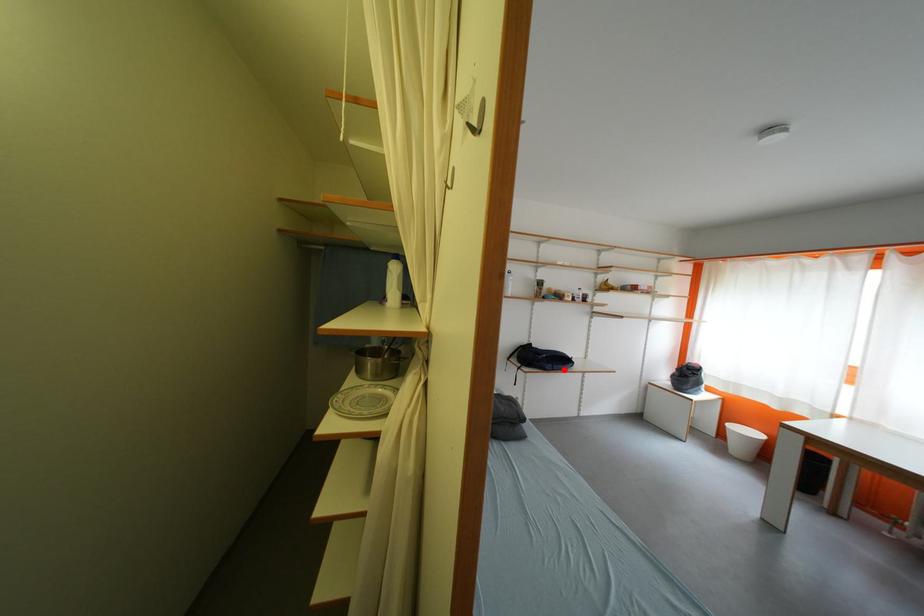
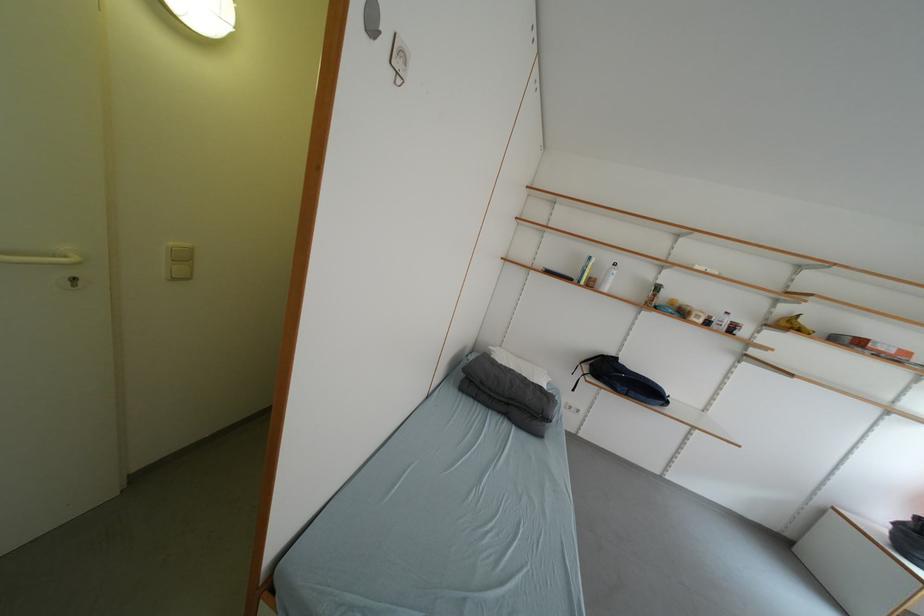
The point at the highlighted location is marked in the first image. Where is the corresponding point in the second image?

(640, 395)